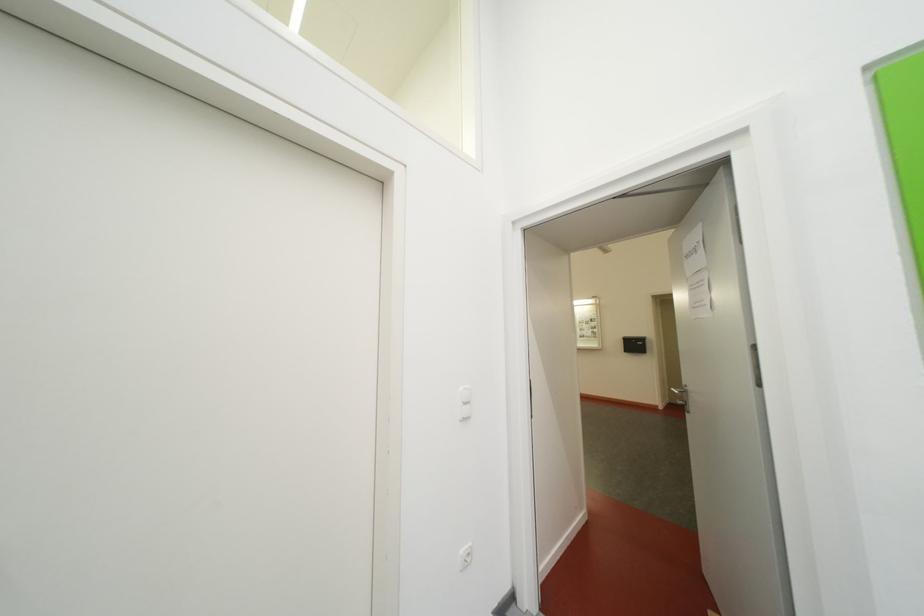
I want to click on silver door handle, so click(x=676, y=392).